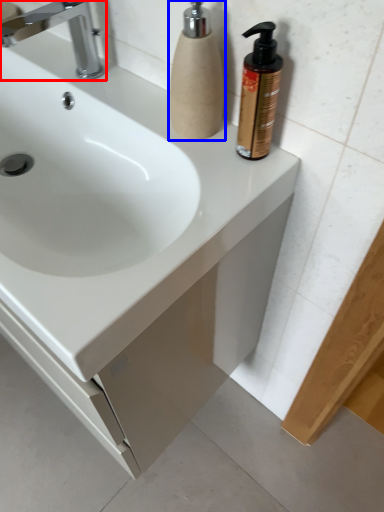
Question: Which point is closer to the camera, tap (highlighted by a red box) or soap dispenser (highlighted by a blue box)?

Choices:
 (A) tap
 (B) soap dispenser

Answer: (B)